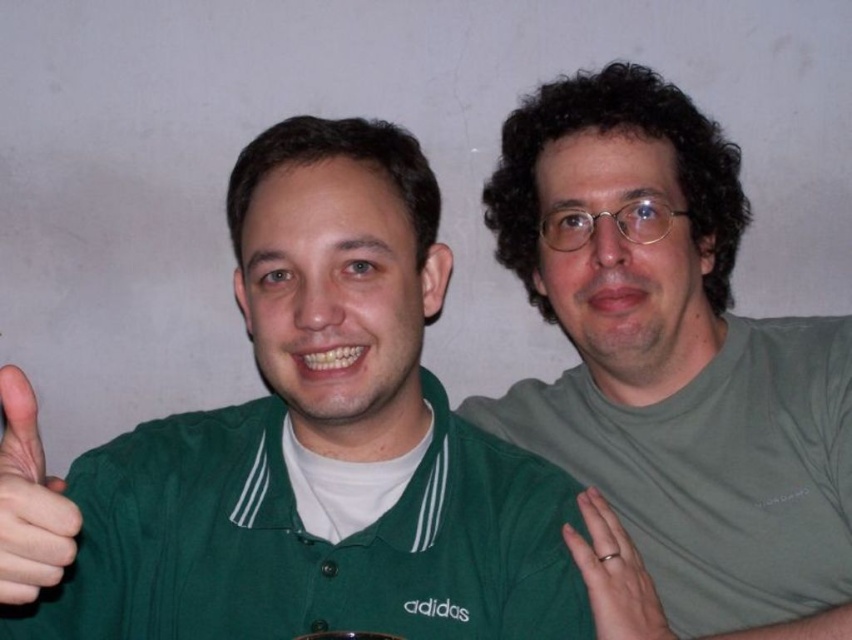
Can you confirm if green fabric hand at left is wider than silver metallic ring at right?

No.

Is the position of green fabric hand at left less distant than that of silver metallic ring at right?

Yes, green fabric hand at left is in front of silver metallic ring at right.

Locate an element on the screen. green fabric hand at left is located at coordinates (29, 500).

Does green matte shirt at upper right come in front of silver metallic ring at right?

No, green matte shirt at upper right is further to the viewer.

Is the position of green matte shirt at upper right more distant than that of silver metallic ring at right?

Yes, green matte shirt at upper right is further from the viewer.

This screenshot has width=852, height=640. I want to click on green matte shirt at upper right, so click(x=671, y=372).

Find the location of a particular element. green matte shirt at upper right is located at coordinates (671, 372).

Is point (124, 525) farther from viewer compared to point (804, 371)?

No, (124, 525) is in front of (804, 371).

The height and width of the screenshot is (640, 852). Describe the element at coordinates (301, 448) in the screenshot. I see `green fabric shirt at left` at that location.

Is point (315, 593) more distant than point (724, 552)?

No, it is not.

This screenshot has width=852, height=640. I want to click on green fabric shirt at left, so click(301, 448).